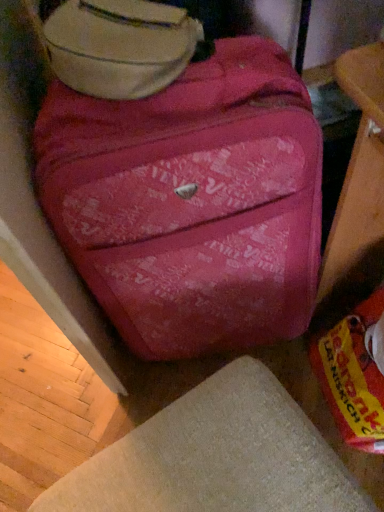
In order to click on vacant space situated above beige fabric ottoman at lower center (from a real-world perspective) in this screenshot , I will do `click(200, 460)`.